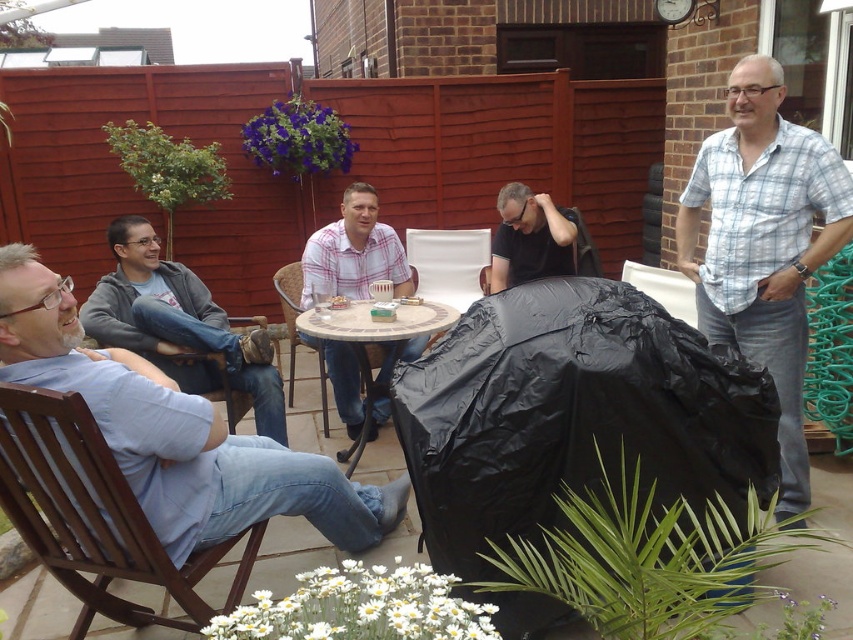
Can you confirm if light blue denim jeans at lower left is positioned to the right of gray fleece jacket at left?

Yes, light blue denim jeans at lower left is to the right of gray fleece jacket at left.

How far apart are light blue denim jeans at lower left and gray fleece jacket at left?

light blue denim jeans at lower left is 1.00 meters away from gray fleece jacket at left.

Is point (289, 497) positioned after point (161, 262)?

No, (289, 497) is closer to viewer.

You are a GUI agent. You are given a task and a screenshot of the screen. Output one action in this format:
    pyautogui.click(x=<x>, y=<y>)
    Task: Click on the light blue denim jeans at lower left
    The width and height of the screenshot is (853, 640).
    Given the screenshot: What is the action you would take?
    pyautogui.click(x=177, y=433)

Can you confirm if mosaic tile table at center is thinner than wooden chair at center?

No.

Does mosaic tile table at center appear over wooden chair at center?

Incorrect, mosaic tile table at center is not positioned above wooden chair at center.

Is point (442, 316) in front of point (293, 300)?

Yes.

The height and width of the screenshot is (640, 853). What are the coordinates of `mosaic tile table at center` in the screenshot? It's located at (374, 342).

How much distance is there between plaid shirt at center and matte black bag at center?

plaid shirt at center is 28.46 inches from matte black bag at center.

Can you confirm if plaid shirt at center is wider than matte black bag at center?

Indeed, plaid shirt at center has a greater width compared to matte black bag at center.

Is point (386, 365) positioned before point (529, 230)?

That is True.

Identify the location of plaid shirt at center. The width and height of the screenshot is (853, 640). (352, 252).